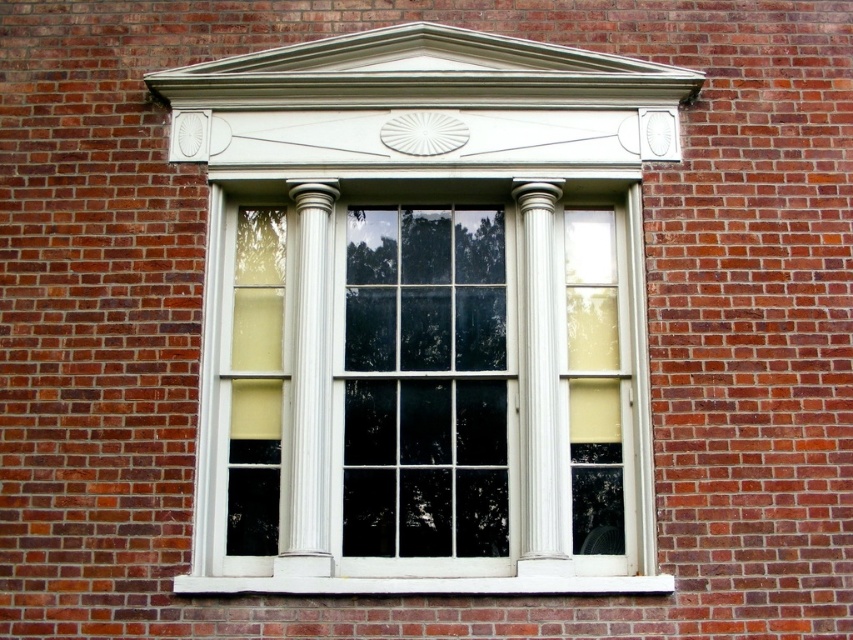
Is white glossy wood bay window at center to the right of white glossy column at center from the viewer's perspective?

Correct, you'll find white glossy wood bay window at center to the right of white glossy column at center.

Which is in front, point (468, 568) or point (321, 426)?

Point (468, 568) is in front.

Find the location of a particular element. The height and width of the screenshot is (640, 853). white glossy wood bay window at center is located at coordinates (424, 372).

Between white glossy wood bay window at center and white painted wood at lower center, which one has less height?

white painted wood at lower center is shorter.

Between point (213, 531) and point (457, 588), which one is positioned in front?

Point (457, 588) is in front.

This screenshot has width=853, height=640. I want to click on white glossy wood bay window at center, so click(424, 372).

Does white glossy column at center have a smaller size compared to white painted wood at lower center?

Incorrect, white glossy column at center is not smaller in size than white painted wood at lower center.

What are the coordinates of `white glossy column at center` in the screenshot? It's located at (309, 387).

Is point (294, 221) farther from camera compared to point (485, 580)?

Yes, point (294, 221) is behind point (485, 580).

Identify the location of white glossy column at center. Image resolution: width=853 pixels, height=640 pixels. (x=309, y=387).